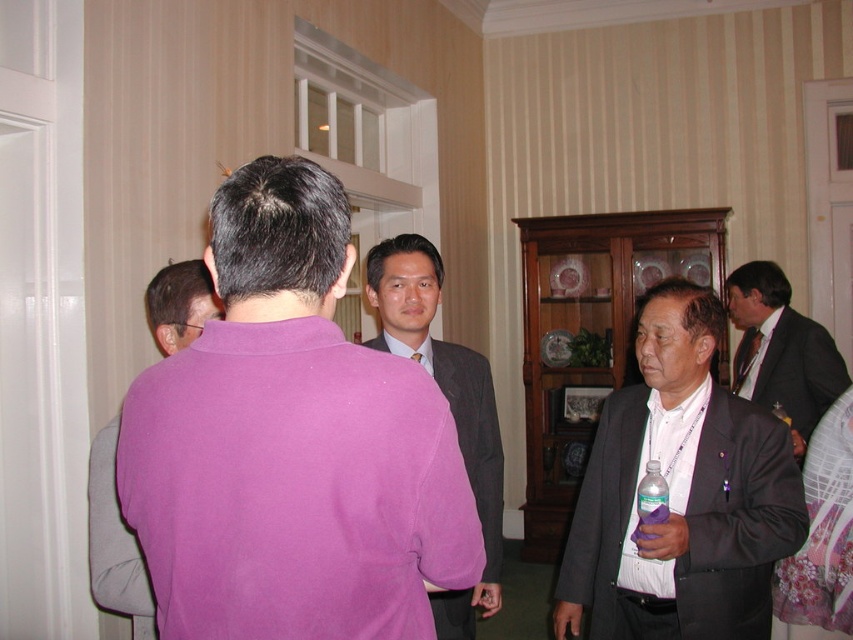
Can you confirm if matte black suit at right is positioned above pink fabric shirt at center?

No.

Image resolution: width=853 pixels, height=640 pixels. Identify the location of matte black suit at right. (680, 492).

What do you see at coordinates (680, 492) in the screenshot? I see `matte black suit at right` at bounding box center [680, 492].

Where is `matte black suit at right`? Image resolution: width=853 pixels, height=640 pixels. matte black suit at right is located at coordinates (680, 492).

Measure the distance between matte gray suit at center and clear plastic bottle at lower right.

25.98 inches

Can you confirm if matte gray suit at center is positioned below clear plastic bottle at lower right?

No, matte gray suit at center is not below clear plastic bottle at lower right.

Does point (410, 323) come in front of point (664, 502)?

That is False.

What are the coordinates of `matte gray suit at center` in the screenshot? It's located at (473, 481).

From the picture: Between purple fleece sweater at left and clear plastic bottle at lower right, which one is positioned lower?

clear plastic bottle at lower right is lower down.

Is point (129, 576) positioned in front of point (648, 524)?

That is True.

Where is `purple fleece sweater at left`? The height and width of the screenshot is (640, 853). purple fleece sweater at left is located at coordinates (114, 541).